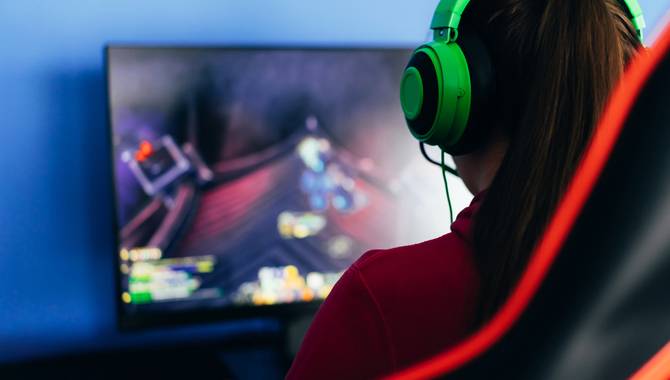
Where is `blue wall`? This screenshot has width=670, height=380. blue wall is located at coordinates (35, 114).